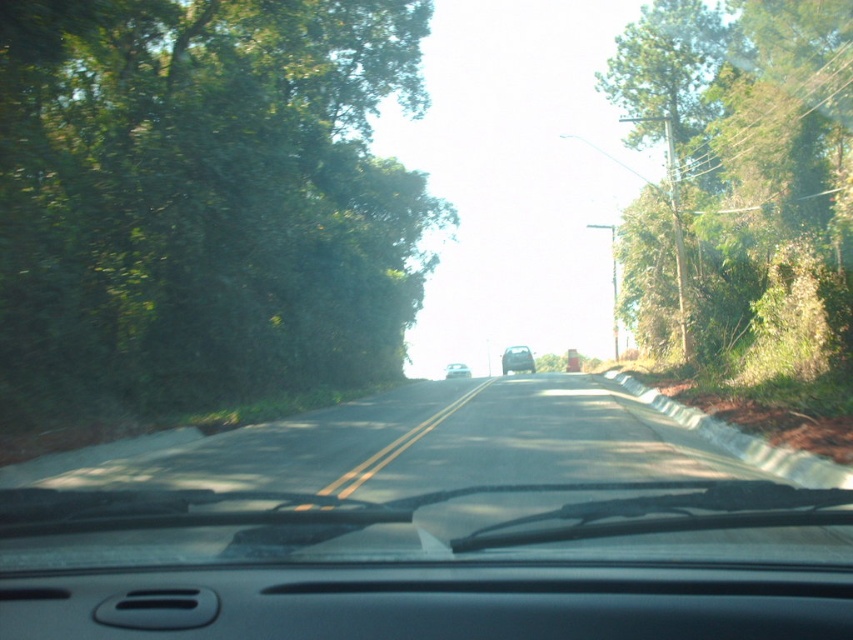
Is green leafy trees at left thinner than asphalt road at center?

Yes, green leafy trees at left is thinner than asphalt road at center.

In the scene shown: Does green leafy trees at left have a larger size compared to asphalt road at center?

Yes.

Image resolution: width=853 pixels, height=640 pixels. What do you see at coordinates (202, 200) in the screenshot?
I see `green leafy trees at left` at bounding box center [202, 200].

Locate an element on the screen. green leafy trees at left is located at coordinates (202, 200).

Does asphalt road at center have a greater width compared to silver metallic car at center?

Yes, asphalt road at center is wider than silver metallic car at center.

Is asphalt road at center below silver metallic car at center?

Actually, asphalt road at center is above silver metallic car at center.

Where is `asphalt road at center`? asphalt road at center is located at coordinates (425, 484).

You are a GUI agent. You are given a task and a screenshot of the screen. Output one action in this format:
    pyautogui.click(x=<x>, y=<y>)
    Task: Click on the asphalt road at center
    This screenshot has height=640, width=853.
    Given the screenshot: What is the action you would take?
    pyautogui.click(x=425, y=484)

Who is more distant from viewer, [39,304] or [448,374]?

The point [448,374] is behind.

Is the position of green leafy trees at left less distant than that of silver metallic car at center?

Yes, green leafy trees at left is in front of silver metallic car at center.

Is point (77, 148) farther from viewer compared to point (465, 369)?

No, (77, 148) is closer to viewer.

You are a GUI agent. You are given a task and a screenshot of the screen. Output one action in this format:
    pyautogui.click(x=<x>, y=<y>)
    Task: Click on the green leafy trees at left
    The height and width of the screenshot is (640, 853).
    Given the screenshot: What is the action you would take?
    pyautogui.click(x=202, y=200)